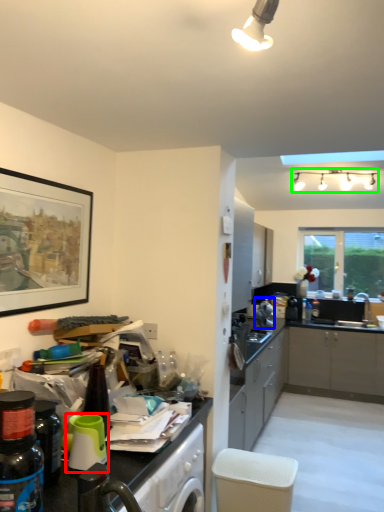
Question: Which is farther away from appliance (highlighted by a red box)? appliance (highlighted by a blue box) or light fixture (highlighted by a green box)?

Choices:
 (A) appliance
 (B) light fixture

Answer: (B)